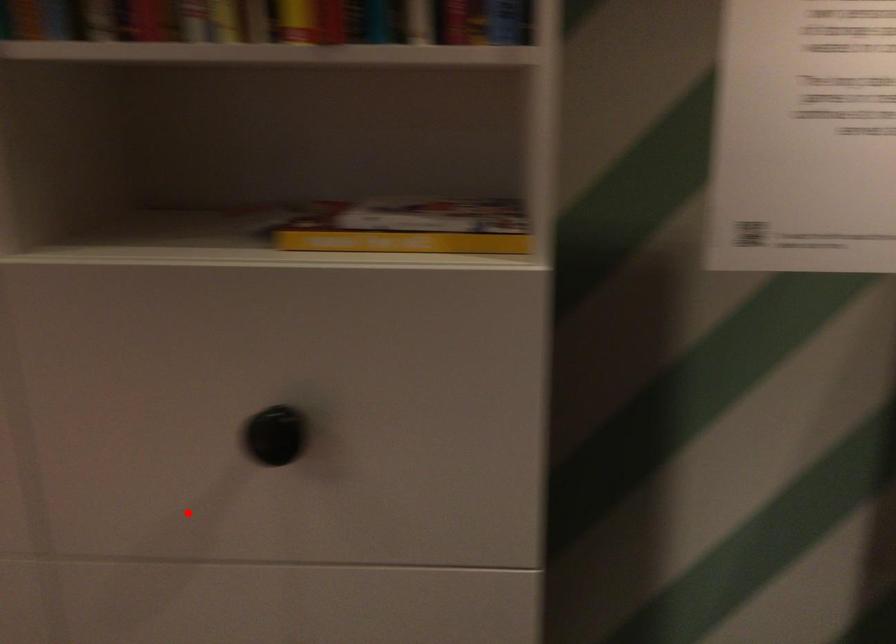
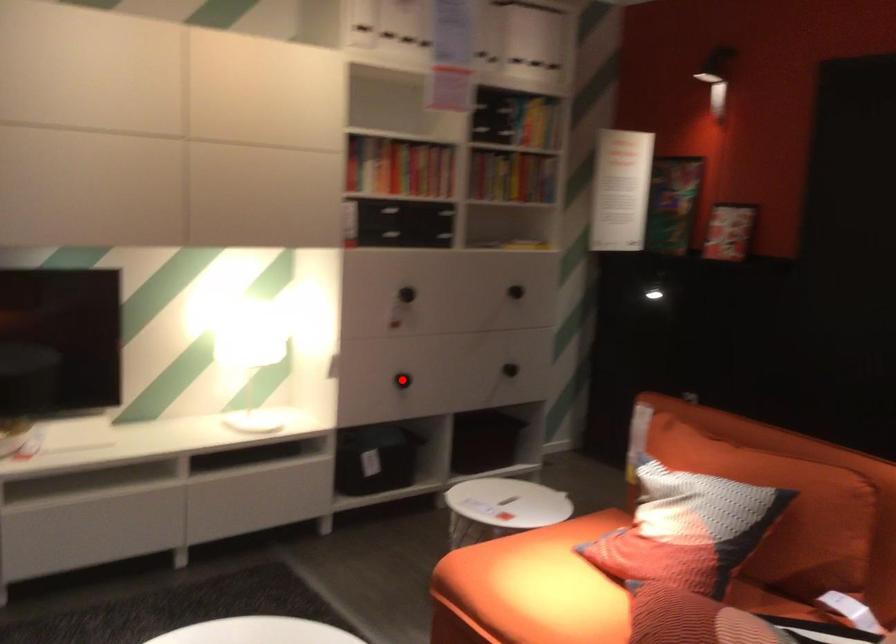
I am providing you with two images of the same scene from different viewpoints. A red point is marked on the first image and another point is marked on the second image. Is the marked point in image1 the same physical position as the marked point in image2?

No